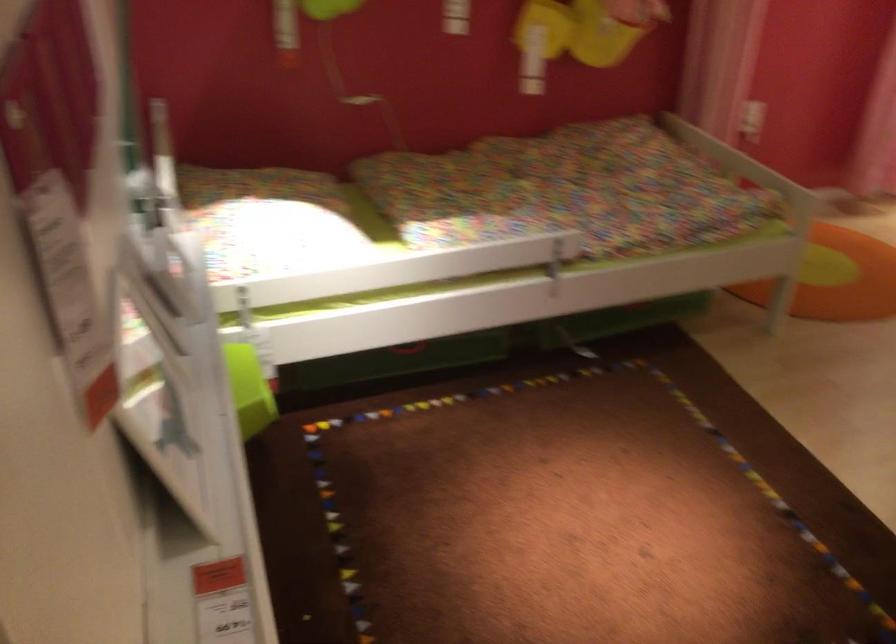
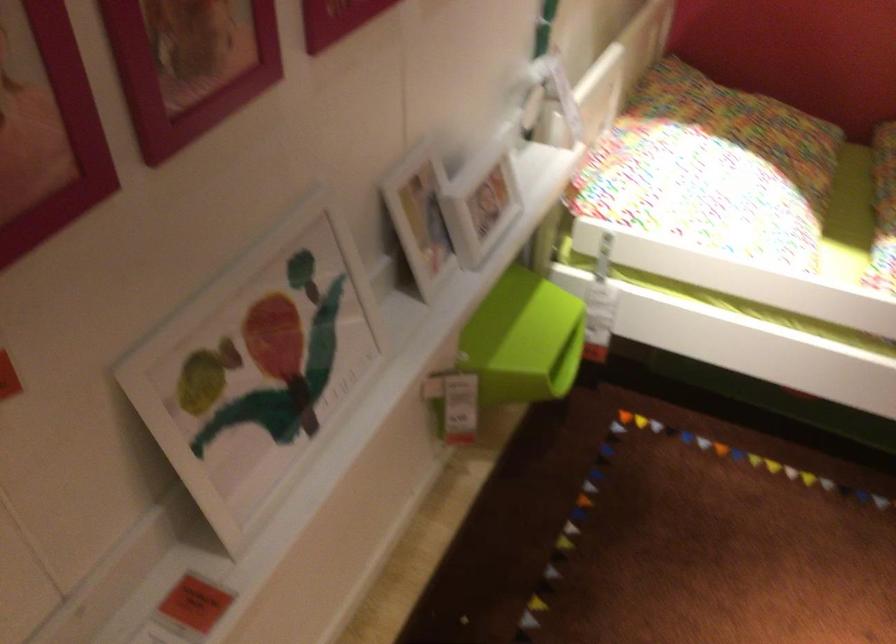
Locate, in the second image, the point that corresponds to pixel 280 225 in the first image.

(712, 169)